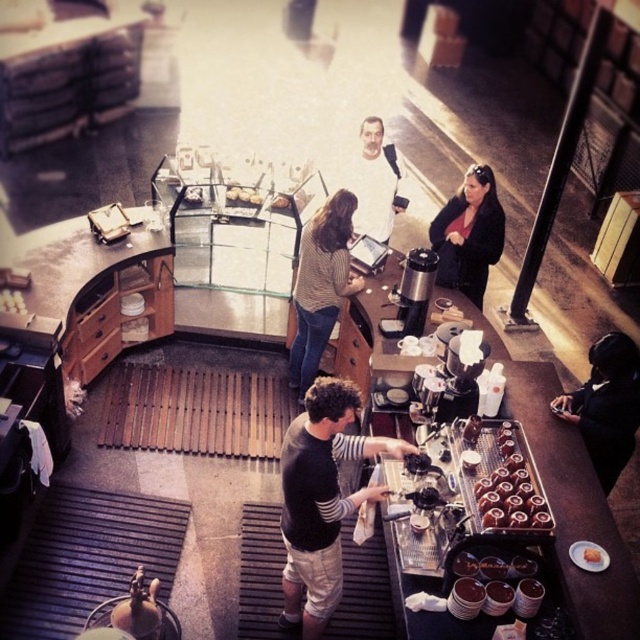
Can you confirm if striped sweater at center is smaller than matte white plate at center?

No.

Does striped sweater at center have a lesser height compared to matte white plate at center?

In fact, striped sweater at center may be taller than matte white plate at center.

Is point (301, 308) closer to viewer compared to point (257, 193)?

Yes, it is.

Locate an element on the screen. Image resolution: width=640 pixels, height=640 pixels. striped sweater at center is located at coordinates (321, 285).

Which is more to the right, chocolate frosted donuts at center or golden brown pastry at center?

golden brown pastry at center is more to the right.

Can you confirm if chocolate frosted donuts at center is smaller than golden brown pastry at center?

No, chocolate frosted donuts at center is not smaller than golden brown pastry at center.

Measure the distance between point (522, 461) and camera.

They are 4.24 meters apart.

Locate an element on the screen. Image resolution: width=640 pixels, height=640 pixels. chocolate frosted donuts at center is located at coordinates (506, 483).

Does striped sweater at center appear on the left side of chocolate frosted donuts at center?

Correct, you'll find striped sweater at center to the left of chocolate frosted donuts at center.

Is striped sweater at center thinner than chocolate frosted donuts at center?

No, striped sweater at center is not thinner than chocolate frosted donuts at center.

Does point (326, 332) come closer to viewer compared to point (493, 444)?

No, it is not.

Locate an element on the screen. Image resolution: width=640 pixels, height=640 pixels. striped sweater at center is located at coordinates (321, 285).